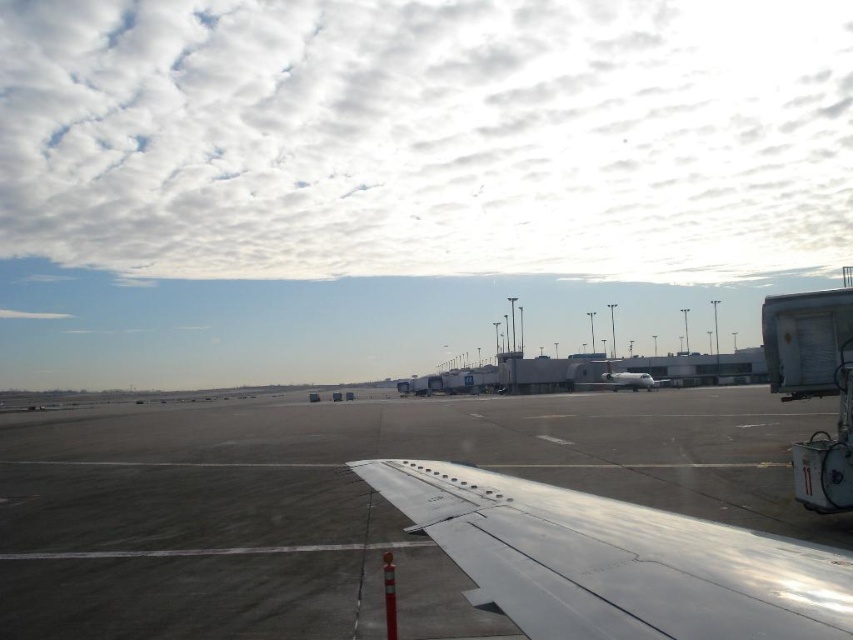
Question: Is cloudy sky at upper center behind white metallic airplane at center?

Choices:
 (A) yes
 (B) no

Answer: (A)

Question: Which object is closer to the camera taking this photo?

Choices:
 (A) silver metallic wing at center
 (B) cloudy sky at upper center
 (C) gray matte tarmac at center
 (D) white metallic airplane at center

Answer: (A)

Question: Can you confirm if cloudy sky at upper center is positioned to the right of white metallic airplane at center?

Choices:
 (A) no
 (B) yes

Answer: (A)

Question: Based on their relative distances, which object is farther from the cloudy sky at upper center?

Choices:
 (A) gray matte tarmac at center
 (B) white metallic airplane at center

Answer: (A)

Question: Does cloudy sky at upper center have a smaller size compared to gray matte tarmac at center?

Choices:
 (A) no
 (B) yes

Answer: (A)

Question: Estimate the real-world distances between objects in this image. Which object is farther from the gray matte tarmac at center?

Choices:
 (A) cloudy sky at upper center
 (B) white metallic airplane at center

Answer: (A)